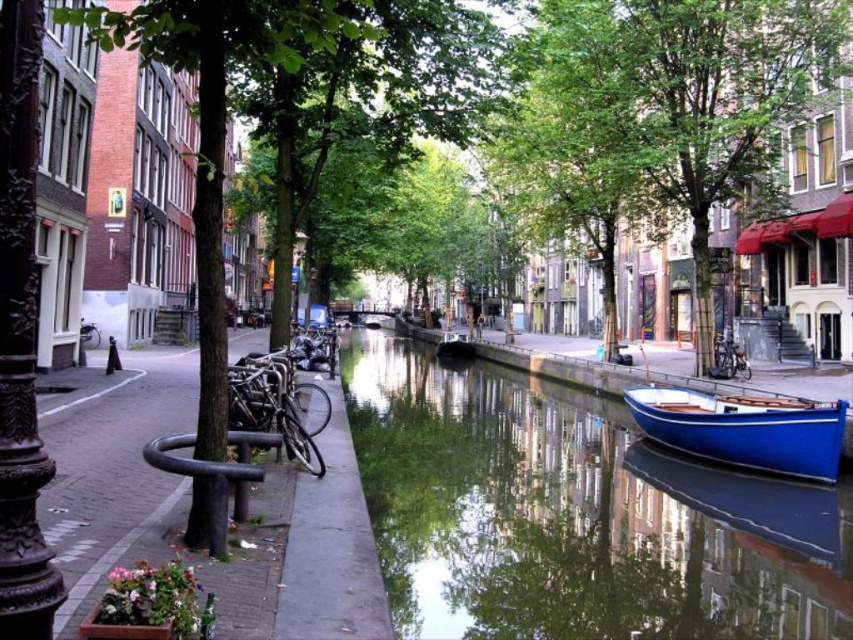
Based on the photo, you are standing at the point closer to the camera between the two points, point [538,410] and point [59,406]. Which point are you standing at?

You are standing at point [59,406] because it is closer to the camera than point [538,410].

You are a tourist standing on the sidewalk near the canal. You see the blue polished wood boat at lower right and the white painted line at lower left. Which object is closer to the water surface?

The blue polished wood boat at lower right is closer to the water surface because it is located below the white painted line at lower left.